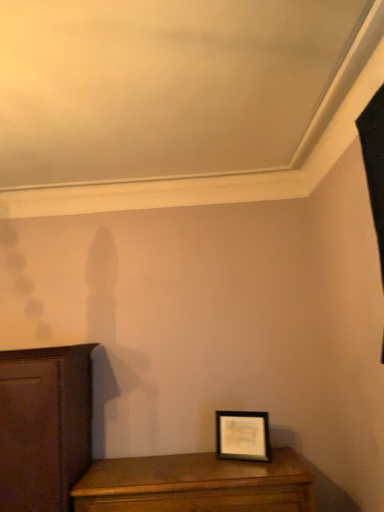
What do you see at coordinates (242, 435) in the screenshot?
I see `black matte picture frame at lower right` at bounding box center [242, 435].

At what (x,y) coordinates should I click in order to perform the action: click on black matte picture frame at lower right. Please return your answer as a coordinate pair (x, y). Looking at the image, I should click on (242, 435).

Measure the distance between point (241, 441) and camera.

They are 2.07 meters apart.

In order to click on black matte picture frame at lower right in this screenshot , I will do `click(242, 435)`.